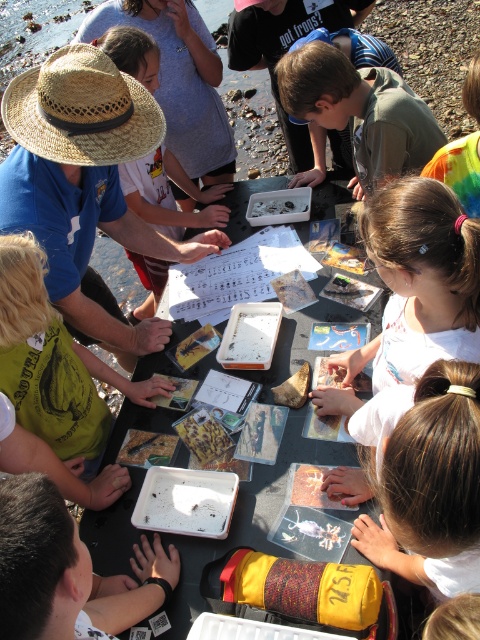
Who is more forward, (235,525) or (91,628)?

Positioned in front is point (91,628).

Which is behind, point (117, 435) or point (43, 545)?

The point (117, 435) is more distant.

Where is `black plastic table at center`? black plastic table at center is located at coordinates point(248,516).

What are the coordinates of `black plastic table at center` in the screenshot? It's located at (248, 516).

Based on the photo, is smooth plastic tray at center shorter than green cotton shirt at upper center?

Correct, smooth plastic tray at center is not as tall as green cotton shirt at upper center.

Who is more forward, (60, 506) or (376, 76)?

Point (60, 506) is more forward.

The image size is (480, 640). I want to click on smooth plastic tray at center, so click(x=64, y=570).

In the scene shown: Can you confirm if black plastic table at center is smaller than golden crispy chips at center?

No, black plastic table at center is not smaller than golden crispy chips at center.

What do you see at coordinates (248, 516) in the screenshot?
I see `black plastic table at center` at bounding box center [248, 516].

You are a GUI agent. You are given a task and a screenshot of the screen. Output one action in this format:
    pyautogui.click(x=<x>, y=<y>)
    Task: Click on the black plastic table at center
    The image size is (480, 640).
    Given the screenshot: What is the action you would take?
    pyautogui.click(x=248, y=516)